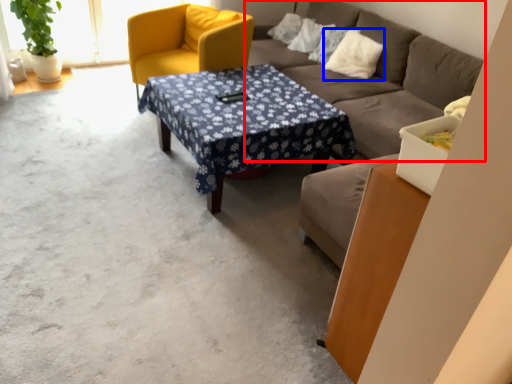
Question: Which object is closer to the camera taking this photo, studio couch (highlighted by a red box) or pillow (highlighted by a blue box)?

Choices:
 (A) studio couch
 (B) pillow

Answer: (A)